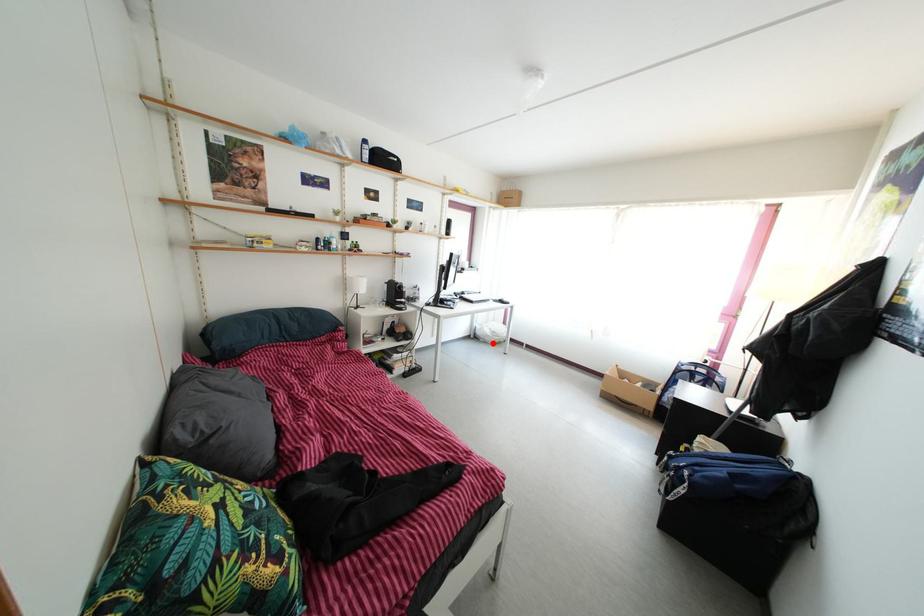
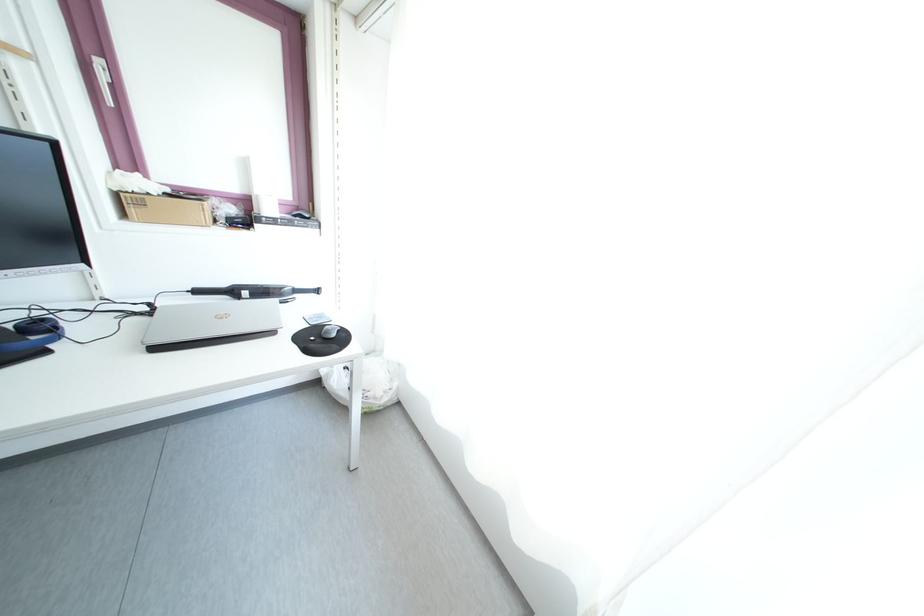
Question: I am providing you with two images of the same scene from different viewpoints. A red point is marked on the first image. Can you still see the location of the red point in image 2?

Choices:
 (A) Yes
 (B) No

Answer: (A)